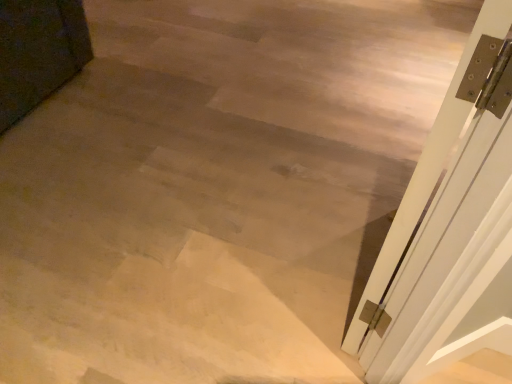
Question: Should I look upward or downward to see white glossy door at right?

Choices:
 (A) up
 (B) down

Answer: (A)